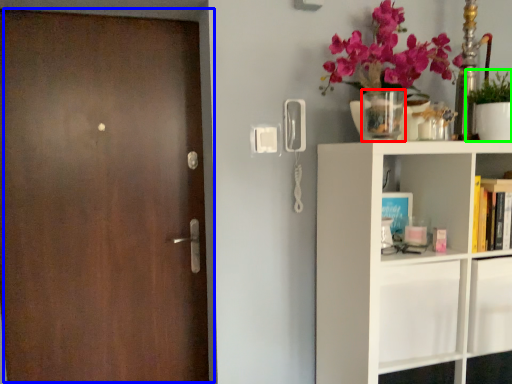
Question: Considering the real-world distances, which object is farthest from vase (highlighted by a red box)? door (highlighted by a blue box) or houseplant (highlighted by a green box)?

Choices:
 (A) door
 (B) houseplant

Answer: (A)